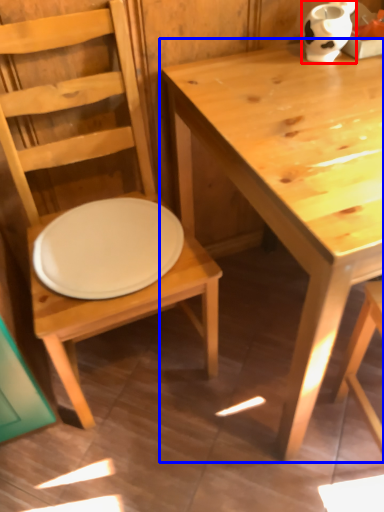
Question: Among these objects, which one is nearest to the camera, vase (highlighted by a red box) or table (highlighted by a blue box)?

Choices:
 (A) vase
 (B) table

Answer: (B)